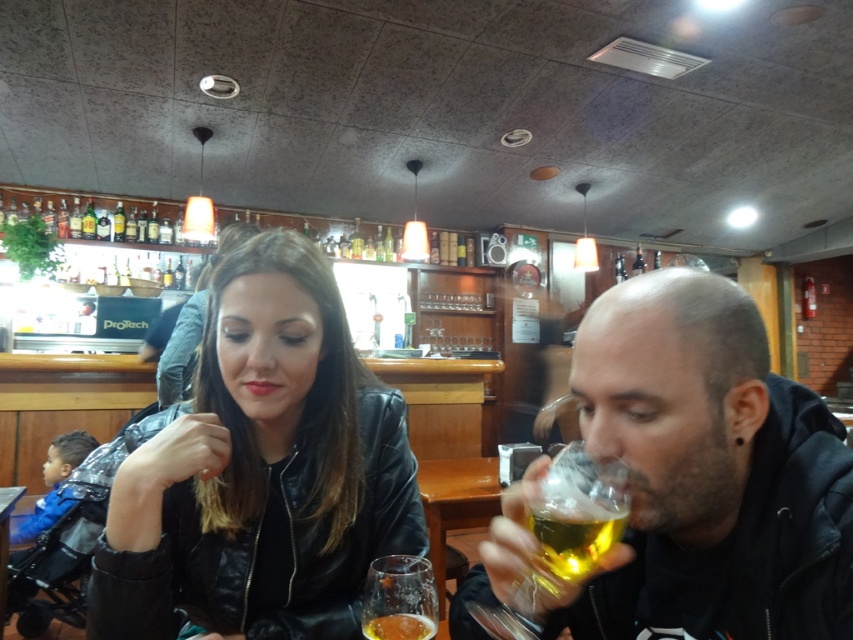
Question: Does black leather jacket at center have a lesser width compared to matte black jacket at right?

Choices:
 (A) yes
 (B) no

Answer: (A)

Question: Considering the real-world distances, which object is farthest from the matte black jacket at right?

Choices:
 (A) wooden table at center
 (B) translucent glass beer at right
 (C) translucent glass beer at lower center

Answer: (A)

Question: Which object appears farthest from the camera in this image?

Choices:
 (A) matte black jacket at right
 (B) translucent glass beer at lower center
 (C) black leather jacket at center

Answer: (C)

Question: Does black leather jacket at center appear on the right side of translucent glass beer at lower center?

Choices:
 (A) yes
 (B) no

Answer: (B)

Question: Can you confirm if translucent glass beer at right is positioned to the right of wooden table at center?

Choices:
 (A) no
 (B) yes

Answer: (B)

Question: Among these points, which one is nearest to the camera?

Choices:
 (A) (529, 600)
 (B) (842, 566)
 (C) (370, 620)
 (D) (200, 445)

Answer: (B)